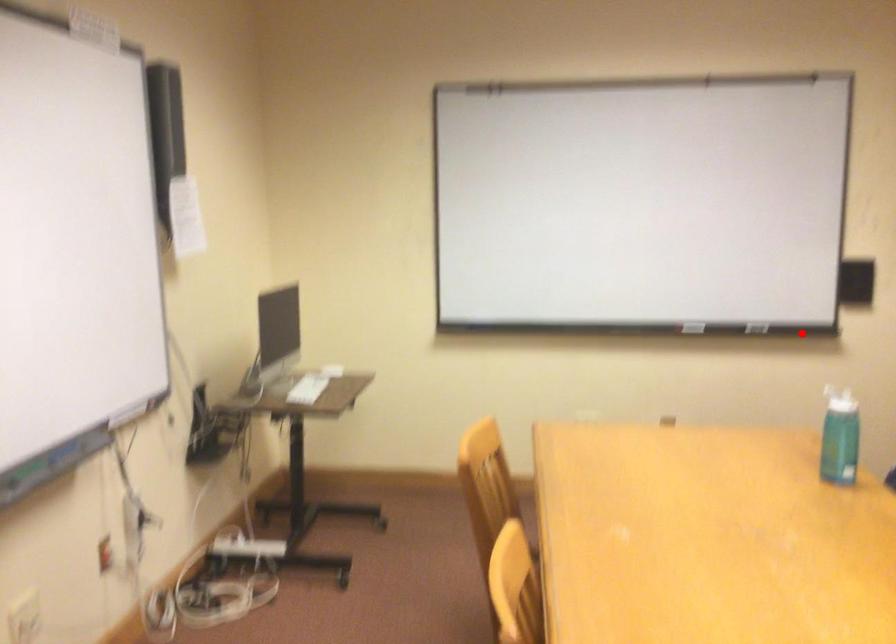
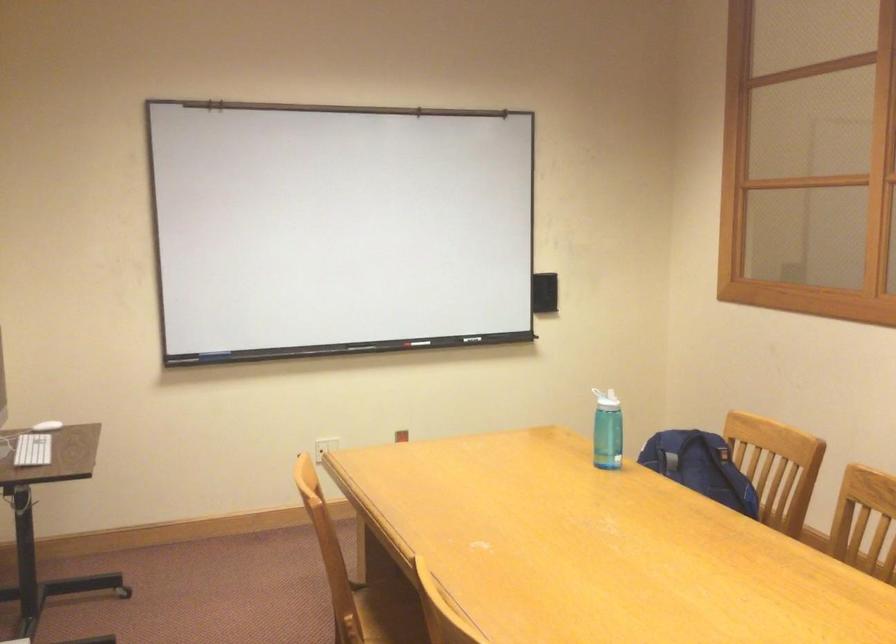
Question: I am providing you with two images of the same scene from different viewpoints. A red point is shown in image1. For the corresponding object point in image2, is it positioned nearer or farther from the camera?

Choices:
 (A) Nearer
 (B) Farther

Answer: (B)